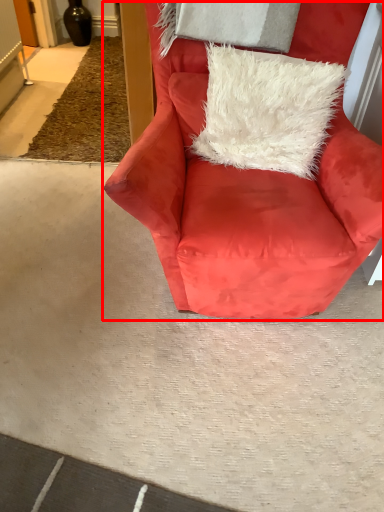
Question: From the image's perspective, where is chair (annotated by the red box) located relative to pillow?

Choices:
 (A) above
 (B) below

Answer: (B)